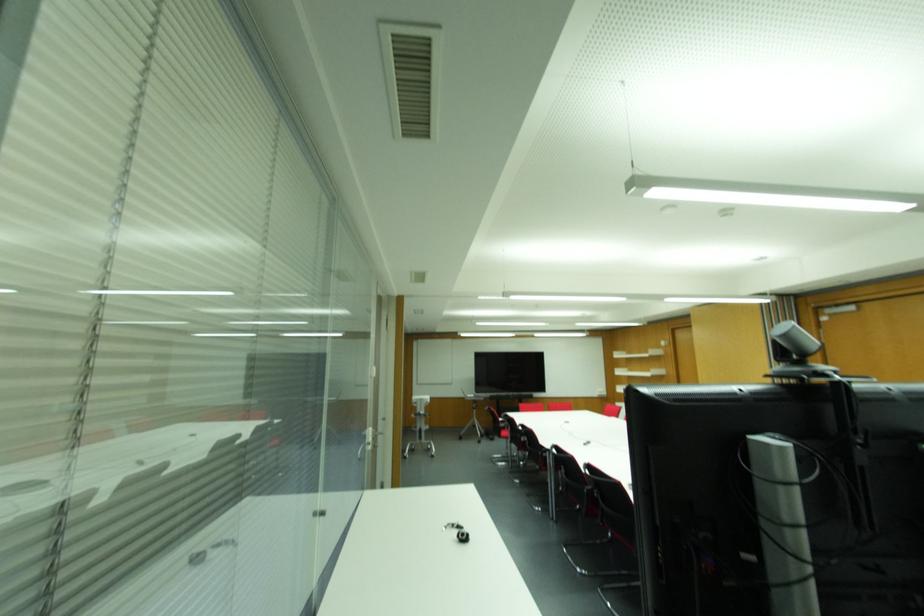
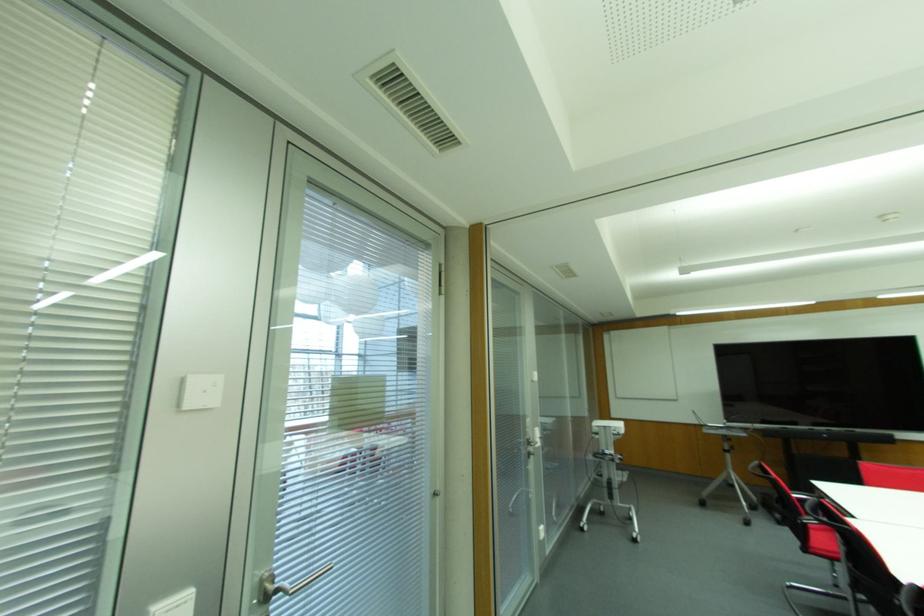
Find the pixel in the second image that matches (x=405, y=456) in the first image.

(581, 529)